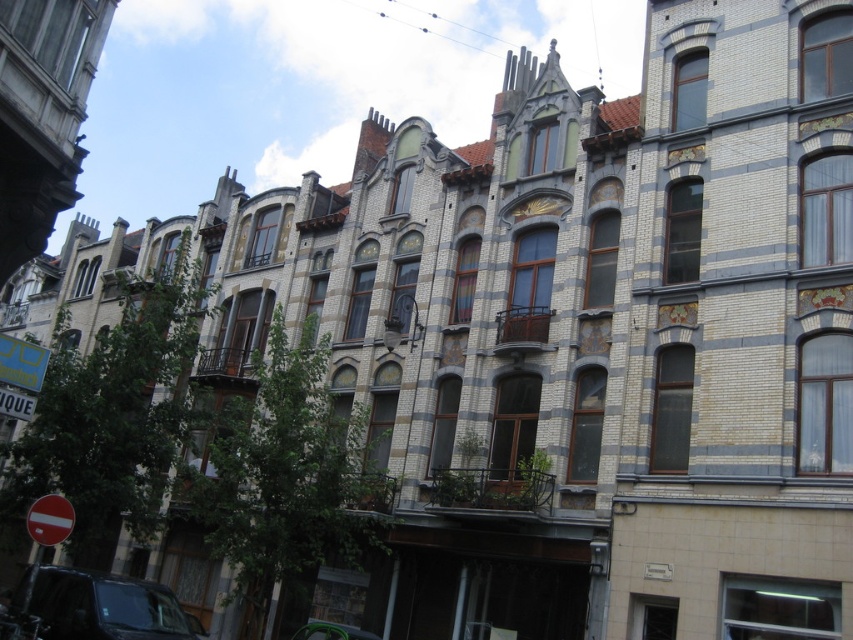
Based on the photo, is shiny black car at lower left taller than red plastic sign at lower left?

Yes.

Which is below, shiny black car at lower left or red plastic sign at lower left?

shiny black car at lower left is lower down.

At what (x,y) coordinates should I click in order to perform the action: click on shiny black car at lower left. Please return your answer as a coordinate pair (x, y). Looking at the image, I should click on (107, 608).

At what (x,y) coordinates should I click in order to perform the action: click on shiny black car at lower left. Please return your answer as a coordinate pair (x, y). The image size is (853, 640). Looking at the image, I should click on (107, 608).

Which of these two, red plastic sign at lower left or metallic silver car at lower center, stands taller?

Standing taller between the two is metallic silver car at lower center.

Based on the photo, who is shorter, red plastic sign at lower left or metallic silver car at lower center?

With less height is red plastic sign at lower left.

Who is more forward, [49,536] or [357,627]?

Point [49,536]

This screenshot has height=640, width=853. Identify the location of red plastic sign at lower left. [x=49, y=518].

Is the position of shiny black car at lower left less distant than that of metallic silver car at lower center?

That is True.

Which of these two, shiny black car at lower left or metallic silver car at lower center, stands taller?

With more height is shiny black car at lower left.

Find the location of `shiny black car at lower left`. shiny black car at lower left is located at coordinates (107, 608).